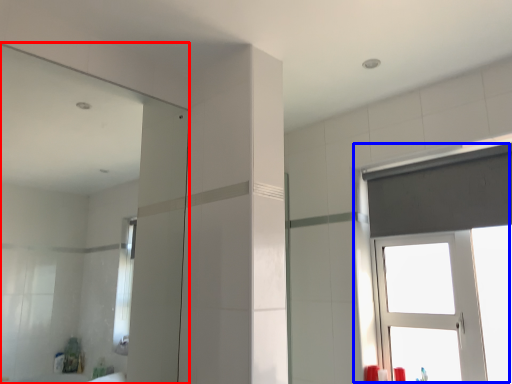
Question: Which of the following is the farthest to the observer, mirror (highlighted by a red box) or window (highlighted by a blue box)?

Choices:
 (A) mirror
 (B) window

Answer: (B)